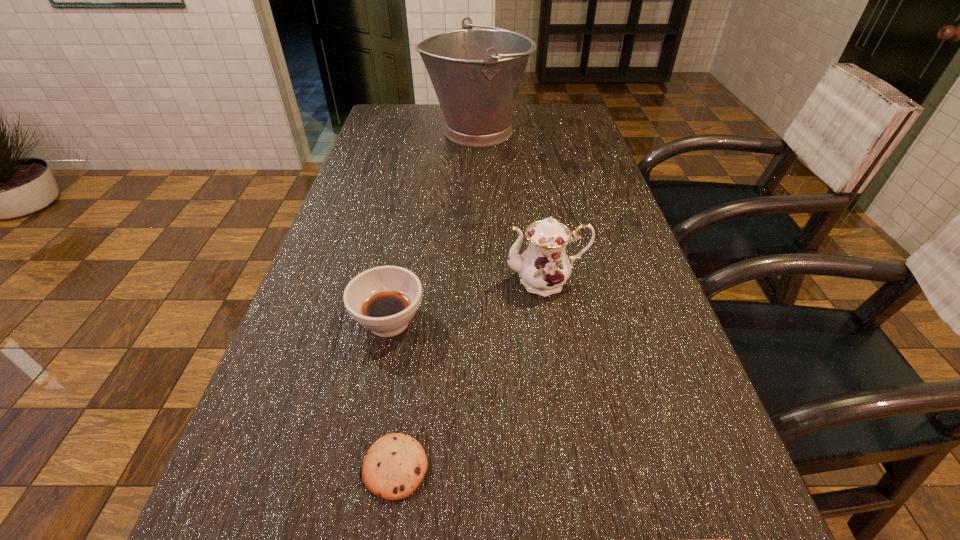
Locate an element on the screen. The image size is (960, 540). object situated at the far edge is located at coordinates (476, 73).

Locate an element on the screen. This screenshot has width=960, height=540. object situated at the left edge is located at coordinates (384, 299).

Where is `object present at the right edge`? object present at the right edge is located at coordinates coord(544,267).

The width and height of the screenshot is (960, 540). What are the coordinates of `vacant region at the far edge` in the screenshot? It's located at (421, 112).

Locate an element on the screen. vacant space at the left edge of the desktop is located at coordinates (370, 169).

You are a GUI agent. You are given a task and a screenshot of the screen. Output one action in this format:
    pyautogui.click(x=<x>, y=<y>)
    Task: Click on the free space at the right edge
    The width and height of the screenshot is (960, 540).
    Given the screenshot: What is the action you would take?
    pyautogui.click(x=630, y=415)

Locate an element on the screen. The image size is (960, 540). free space between the third shortest object and the fourth farthest object is located at coordinates (393, 394).

Identify the location of empty location between the fourth shortest object and the third shortest object. (468, 301).

At what (x,y) coordinates should I click in order to perform the action: click on vacant area that lies between the bucket and the chinaware. Please return your answer as a coordinate pair (x, y). This screenshot has width=960, height=540. Looking at the image, I should click on (511, 207).

Locate an element on the screen. The height and width of the screenshot is (540, 960). unoccupied area between the chinaware and the bucket is located at coordinates (511, 207).